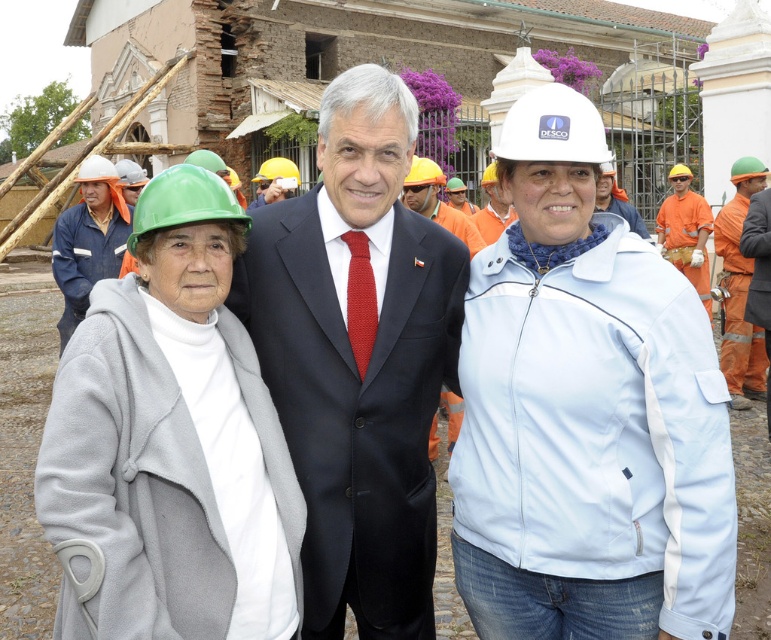
You are an architect visiting a construction site. You see the matte black suit at center and the green hard hat at left. Which object is wider?

The green hard hat at left is wider than the matte black suit at center.

You are an inspector checking safety gear on a construction site. You notice two hard hats here, the white hard hat at center and the green matte hard hat at left. Which hard hat has a greater width?

The white hard hat at center has a greater width than the green matte hard hat at left according to the description.